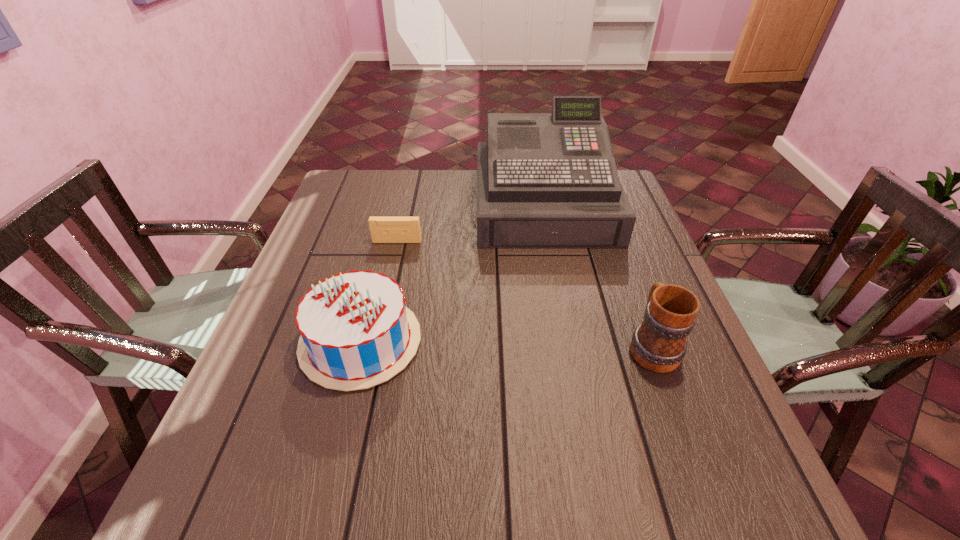
Where is `vacant space in between the birthday cake and the mug`? vacant space in between the birthday cake and the mug is located at coordinates (506, 343).

You are a GUI agent. You are given a task and a screenshot of the screen. Output one action in this format:
    pyautogui.click(x=<x>, y=<y>)
    Task: Click on the empty location between the tallest object and the mug
    The width and height of the screenshot is (960, 540).
    Given the screenshot: What is the action you would take?
    pyautogui.click(x=598, y=275)

Find the location of a particular element. free spot between the mug and the videotape is located at coordinates (524, 294).

This screenshot has width=960, height=540. I want to click on free point between the cash register and the birthday cake, so click(x=452, y=273).

This screenshot has width=960, height=540. I want to click on vacant area that lies between the tallest object and the birthday cake, so (452, 273).

This screenshot has width=960, height=540. Identify the location of free space between the birthday cake and the mug. (506, 343).

At what (x,y) coordinates should I click in order to perform the action: click on free area in between the cash register and the birthday cake. Please return your answer as a coordinate pair (x, y). Looking at the image, I should click on (452, 273).

Locate an element on the screen. Image resolution: width=960 pixels, height=540 pixels. vacant space in between the mug and the shortest object is located at coordinates (524, 294).

Locate which object is the closest to the videotape. Please provide its 2D coordinates. Your answer should be formatted as a tuple, i.e. [(x, y)], where the tuple contains the x and y coordinates of a point satisfying the conditions above.

[(544, 180)]

Point out which object is positioned as the nearest to the tallest object. Please provide its 2D coordinates. Your answer should be formatted as a tuple, i.e. [(x, y)], where the tuple contains the x and y coordinates of a point satisfying the conditions above.

[(383, 229)]